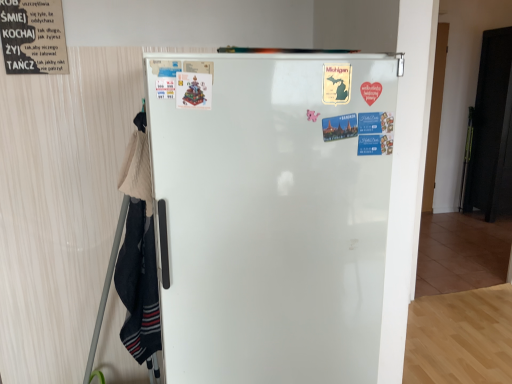
Question: Is black matte door at right in contact with matte plastic poster at center, the 2th poster positioned from the left?

Choices:
 (A) yes
 (B) no

Answer: (B)

Question: From the image's perspective, is black matte door at right above matte plastic poster at center, the 2th poster positioned from the left?

Choices:
 (A) no
 (B) yes

Answer: (B)

Question: Is black matte door at right at the left side of matte plastic poster at center, which is counted as the first poster, starting from the front?

Choices:
 (A) no
 (B) yes

Answer: (A)

Question: Considering the relative sizes of black matte door at right and matte plastic poster at center, the 2th poster positioned from the left, in the image provided, is black matte door at right bigger than matte plastic poster at center, the 2th poster positioned from the left,?

Choices:
 (A) no
 (B) yes

Answer: (B)

Question: Are black matte door at right and matte plastic poster at center, the 2th poster positioned from the left, far apart?

Choices:
 (A) yes
 (B) no

Answer: (A)

Question: Is matte plastic poster at center, which is counted as the first poster, starting from the front, in front of or behind white glossy refrigerator at center in the image?

Choices:
 (A) front
 (B) behind

Answer: (B)

Question: Based on their positions, is matte plastic poster at center, which is counted as the first poster, starting from the front, located to the left or right of white glossy refrigerator at center?

Choices:
 (A) left
 (B) right

Answer: (A)

Question: From a real-world perspective, relative to white glossy refrigerator at center, is matte plastic poster at center, which is counted as the first poster, starting from the front, vertically above or below?

Choices:
 (A) below
 (B) above

Answer: (B)

Question: From the image's perspective, is matte plastic poster at center, the second poster positioned from the top, positioned above or below white glossy refrigerator at center?

Choices:
 (A) below
 (B) above

Answer: (B)

Question: Which is correct: white glossy refrigerator at center is inside black matte door at right, or outside of it?

Choices:
 (A) outside
 (B) inside

Answer: (A)

Question: In the image, is white glossy refrigerator at center on the left side or the right side of black matte door at right?

Choices:
 (A) right
 (B) left

Answer: (B)

Question: Is white glossy refrigerator at center wider or thinner than black matte door at right?

Choices:
 (A) wide
 (B) thin

Answer: (A)

Question: Considering the positions of point (359, 317) and point (498, 107), is point (359, 317) closer or farther from the camera than point (498, 107)?

Choices:
 (A) closer
 (B) farther

Answer: (A)

Question: In terms of size, does black paper poster at upper left, the 1th poster in the back-to-front sequence, appear bigger or smaller than white glossy refrigerator at center?

Choices:
 (A) small
 (B) big

Answer: (A)

Question: Relative to white glossy refrigerator at center, is black paper poster at upper left, the second poster positioned from the bottom, in front or behind?

Choices:
 (A) behind
 (B) front

Answer: (A)